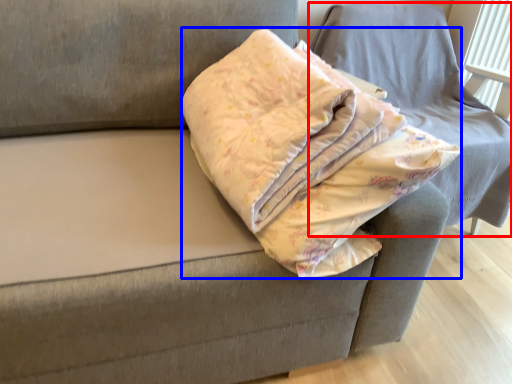
Question: Which object is closer to the camera taking this photo, furniture (highlighted by a red box) or throw pillow (highlighted by a blue box)?

Choices:
 (A) furniture
 (B) throw pillow

Answer: (B)